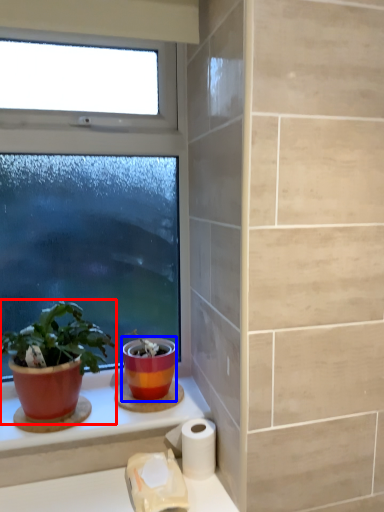
Question: Among these objects, which one is farthest to the camera, houseplant (highlighted by a red box) or flowerpot (highlighted by a blue box)?

Choices:
 (A) houseplant
 (B) flowerpot

Answer: (B)